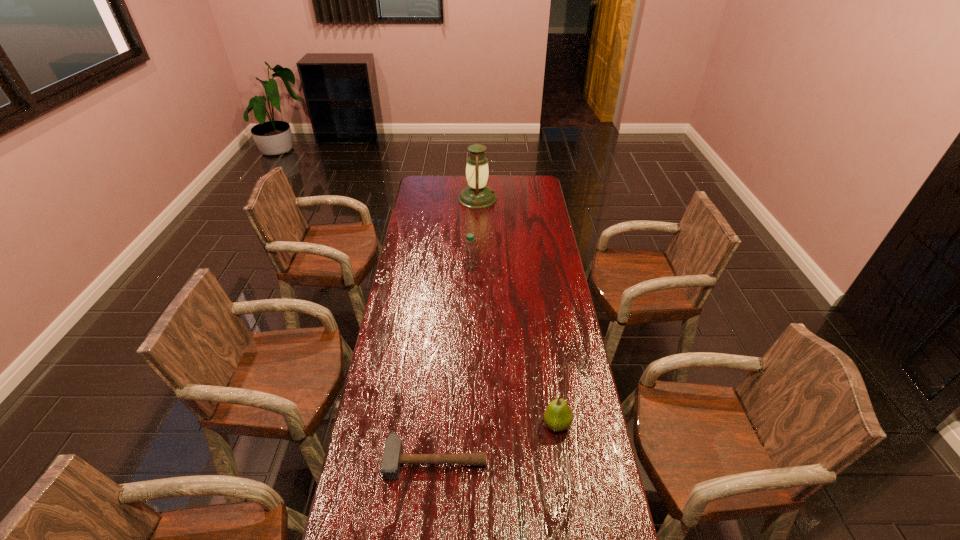
Image resolution: width=960 pixels, height=540 pixels. Identify the location of object that stands as the third closest to the nearest object. (477, 195).

Where is `vacant point that satisfies the following two spatial constraints: 1. with the light compartment facing forward on the farthest object; 2. on the striking surface of the nearest object`? The width and height of the screenshot is (960, 540). vacant point that satisfies the following two spatial constraints: 1. with the light compartment facing forward on the farthest object; 2. on the striking surface of the nearest object is located at coordinates (475, 460).

Find the location of a particular element. vacant region that satisfies the following two spatial constraints: 1. with the light compartment facing forward on the pear; 2. on the right side of the tallest object is located at coordinates (475, 424).

Where is `free location that satisfies the following two spatial constraints: 1. with the light compartment facing forward on the lantern; 2. on the front side of the water bottle`? The image size is (960, 540). free location that satisfies the following two spatial constraints: 1. with the light compartment facing forward on the lantern; 2. on the front side of the water bottle is located at coordinates (477, 266).

You are a GUI agent. You are given a task and a screenshot of the screen. Output one action in this format:
    pyautogui.click(x=<x>, y=<y>)
    Task: Click on the blank area in the image that satisfies the following two spatial constraints: 1. on the front side of the rightmost object; 2. on the right side of the second tallest object
    The height and width of the screenshot is (540, 960).
    Given the screenshot: What is the action you would take?
    tap(467, 424)